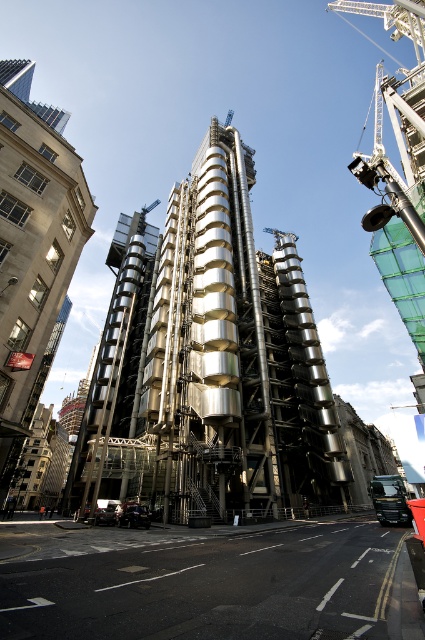
Is metallic silver tower at center further to camera compared to silver metallic building at left?

Yes, it is behind silver metallic building at left.

Based on the photo, is metallic silver tower at center smaller than silver metallic building at left?

Correct, metallic silver tower at center occupies less space than silver metallic building at left.

Find the location of a particular element. This screenshot has width=425, height=640. metallic silver tower at center is located at coordinates (210, 362).

Identify the location of metallic silver tower at center. The height and width of the screenshot is (640, 425). (210, 362).